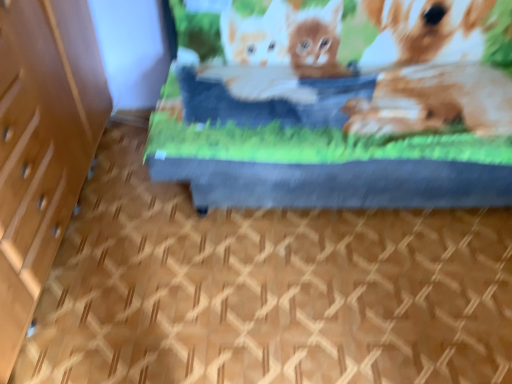
What do you see at coordinates (42, 145) in the screenshot? The image size is (512, 384). I see `wooden file cabinet at left` at bounding box center [42, 145].

Locate an element on the screen. The height and width of the screenshot is (384, 512). wooden file cabinet at left is located at coordinates (42, 145).

What do you see at coordinates (342, 106) in the screenshot?
I see `blue fabric bed at center` at bounding box center [342, 106].

Where is `blue fabric bed at center`? The image size is (512, 384). blue fabric bed at center is located at coordinates (342, 106).

Where is `wooden file cabinet at left`? The width and height of the screenshot is (512, 384). wooden file cabinet at left is located at coordinates (42, 145).

Considering the relative positions of blue fabric bed at center and wooden file cabinet at left in the image provided, is blue fabric bed at center to the right of wooden file cabinet at left from the viewer's perspective?

Yes.

Relative to wooden file cabinet at left, is blue fabric bed at center in front or behind?

Clearly, blue fabric bed at center is behind wooden file cabinet at left.

Is point (319, 24) positioned after point (49, 180)?

Yes.

In the scene shown: From the image's perspective, is blue fabric bed at center above or below wooden file cabinet at left?

Clearly, from the image's perspective, blue fabric bed at center is above wooden file cabinet at left.

From a real-world perspective, which is physically above, blue fabric bed at center or wooden file cabinet at left?

wooden file cabinet at left.

Which of these two, blue fabric bed at center or wooden file cabinet at left, is wider?

Answer: Wider between the two is blue fabric bed at center.

Between blue fabric bed at center and wooden file cabinet at left, which one has less height?

blue fabric bed at center.

Based on the photo, between blue fabric bed at center and wooden file cabinet at left, which one has larger size?

Bigger between the two is blue fabric bed at center.

Is blue fabric bed at center spatially inside wooden file cabinet at left, or outside of it?

blue fabric bed at center is located beyond the bounds of wooden file cabinet at left.

Are blue fabric bed at center and wooden file cabinet at left located far from each other?

blue fabric bed at center is near wooden file cabinet at left, not far away.

Is wooden file cabinet at left at the back of blue fabric bed at center?

No, blue fabric bed at center's orientation is not away from wooden file cabinet at left.

Can you tell me how much blue fabric bed at center and wooden file cabinet at left differ in facing direction?

They differ by 91.6 degrees in their facing directions.

I want to click on bed behind the wooden file cabinet at left, so click(342, 106).

Can you confirm if wooden file cabinet at left is positioned to the left of blue fabric bed at center?

Correct, you'll find wooden file cabinet at left to the left of blue fabric bed at center.

Is the position of wooden file cabinet at left more distant than that of blue fabric bed at center?

No, the depth of wooden file cabinet at left is less than that of blue fabric bed at center.

Does point (42, 151) lie behind point (415, 18)?

No, it is not.

From the image's perspective, is wooden file cabinet at left on blue fabric bed at center?

No, from the image's perspective, wooden file cabinet at left is not on top of blue fabric bed at center.

From a real-world perspective, is wooden file cabinet at left physically below blue fabric bed at center?

No, from a real-world perspective, wooden file cabinet at left is not beneath blue fabric bed at center.

Which object is thinner, wooden file cabinet at left or blue fabric bed at center?

wooden file cabinet at left.

Considering the sizes of wooden file cabinet at left and blue fabric bed at center in the image, is wooden file cabinet at left taller or shorter than blue fabric bed at center?

Clearly, wooden file cabinet at left is taller compared to blue fabric bed at center.

In terms of size, does wooden file cabinet at left appear bigger or smaller than blue fabric bed at center?

In the image, wooden file cabinet at left appears to be smaller than blue fabric bed at center.

Is wooden file cabinet at left outside of blue fabric bed at center?

Yes, wooden file cabinet at left is not within blue fabric bed at center.

Is wooden file cabinet at left not near blue fabric bed at center?

They are positioned close to each other.

Based on the photo, is wooden file cabinet at left oriented towards blue fabric bed at center?

Yes, wooden file cabinet at left faces towards blue fabric bed at center.

How many degrees apart are the facing directions of wooden file cabinet at left and blue fabric bed at center?

They differ by 91.6 degrees in their facing directions.

At what (x,y) coordinates should I click in order to perform the action: click on bed below the wooden file cabinet at left (from a real-world perspective). Please return your answer as a coordinate pair (x, y). The image size is (512, 384). Looking at the image, I should click on pyautogui.click(x=342, y=106).

Find the location of a particular element. Image resolution: width=512 pixels, height=384 pixels. bed behind the wooden file cabinet at left is located at coordinates (342, 106).

The height and width of the screenshot is (384, 512). Identify the location of bed located on the right of wooden file cabinet at left. (342, 106).